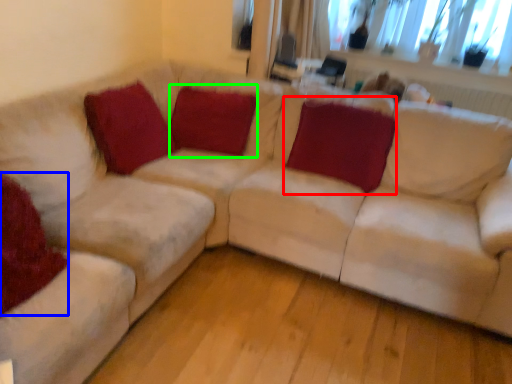
Question: Estimate the real-world distances between objects in this image. Which object is farther from pillow (highlighted by a red box), pillow (highlighted by a blue box) or pillow (highlighted by a green box)?

Choices:
 (A) pillow
 (B) pillow

Answer: (A)